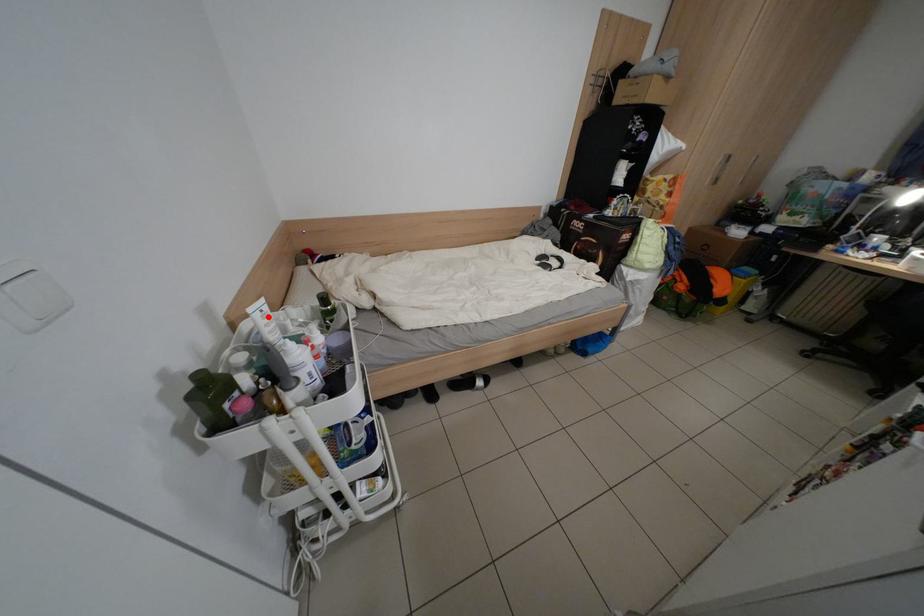
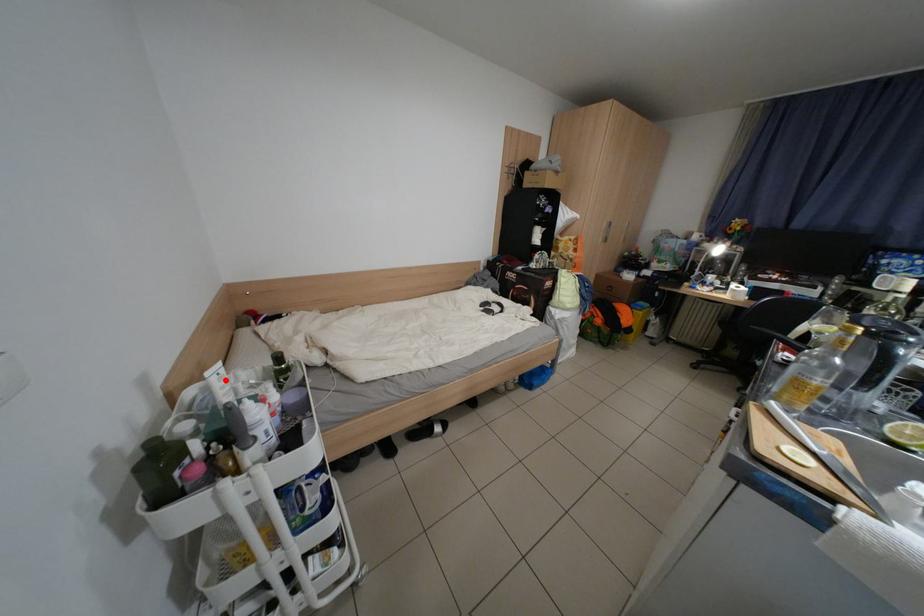
I am providing you with two images of the same scene from different viewpoints. A red point is marked on the first image and another point is marked on the second image. Do the highlighted points in image1 and image2 indicate the same real-world spot?

Yes